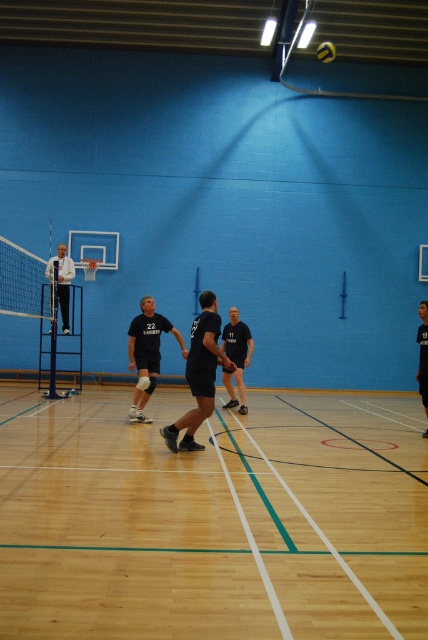
You are a photographer positioned at the back of the gymnasium. You need to take a photo that includes both the white matte jacket at left and the dark blue jersey at center. Which object will appear larger in your photo?

The white matte jacket at left appears larger in the photo because it is closer to the photographer than the dark blue jersey at center.

You are a volleyball player standing at the center of the court. You see a point marked at coordinates (62, 282). What object is located at that point?

The point at coordinates (62, 282) marks the location of the white matte jacket at left.

You are a volleyball player standing at the center of the court. You notice a point marked at coordinates (x=199, y=374). What object is located at that point?

The point marked at coordinates (x=199, y=374) is where the black matte jersey at center is located.